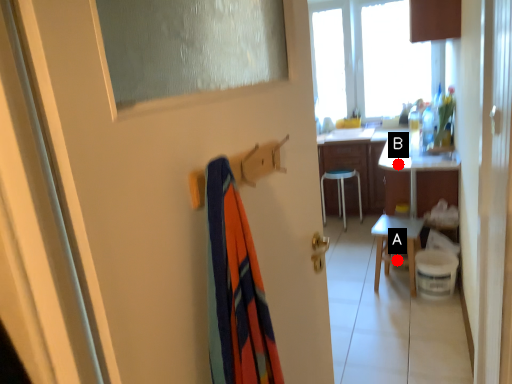
Question: Two points are circled on the image, labeled by A and B beside each circle. Which of the following is the farthest from the observer?

Choices:
 (A) A is further
 (B) B is further

Answer: (A)